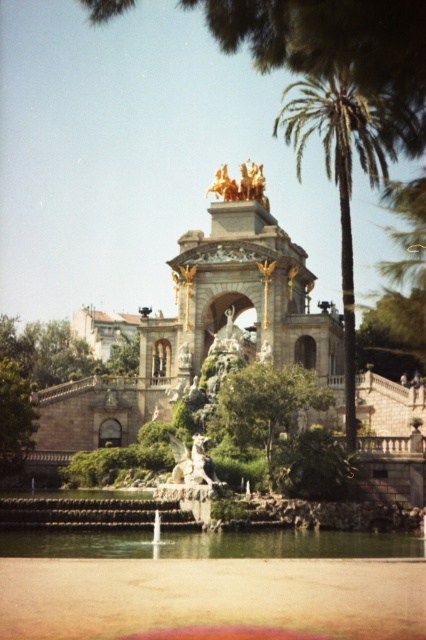
You are standing at the entrance of the monument and want to take a photo of the golden statue atop the structure while including the green leafy tree at center in the frame. Based on their positions, will the tree be in the foreground or background of the photo?

The green leafy tree at center is located at point 0.627, which is closer to the viewer than the golden statue atop the structure. Therefore, the tree will be in the foreground of the photo.

You are standing in front of the grand architectural structure and want to take a photo. You notice two points marked in the scene. The first point is at coordinates point (226,413) and the second is at point (16,472). Which point is closer to your current position?

Point (226,413) is closer to the camera than point (16,472), so the first point is closer to your current position.

You are a visitor standing at the entrance of the park, looking towards the grand structure. You notice two green leafy trees in the scene. Which tree, the green leafy palm tree at upper right or the green leafy tree at center, would appear larger in your field of view?

The green leafy palm tree at upper right is much taller than the green leafy tree at center, so it would appear larger in your field of view.